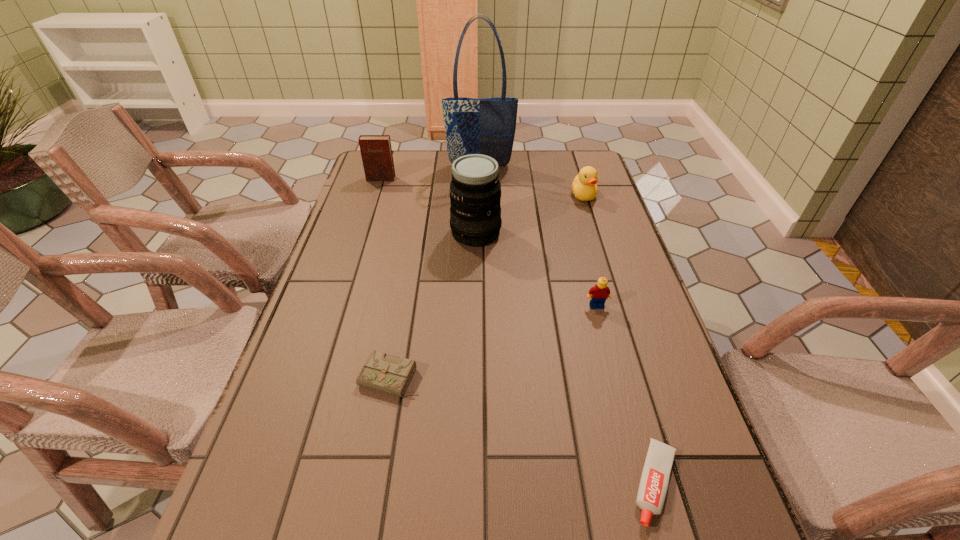
Locate an element on the screen. the shorter diary is located at coordinates (380, 372).

Find the location of a particular element. The width and height of the screenshot is (960, 540). toothpaste is located at coordinates (653, 486).

Identify the location of vacant space situated on the front-facing side of the tallest object. (480, 193).

The width and height of the screenshot is (960, 540). Find the location of `free space located on the front of the second tallest object`. free space located on the front of the second tallest object is located at coordinates click(474, 350).

Locate an element on the screen. This screenshot has height=540, width=960. free location located on the front cover of the second farthest object is located at coordinates (372, 207).

Locate an element on the screen. free space located on the face of the third farthest object is located at coordinates (599, 244).

The image size is (960, 540). Find the location of `free space located on the front-facing side of the third nearest object`. free space located on the front-facing side of the third nearest object is located at coordinates (602, 326).

Find the location of a particular element. blank space located on the back of the sixth farthest object is located at coordinates (398, 328).

The image size is (960, 540). What are the coordinates of `vacant space located on the left of the nearest object` in the screenshot? It's located at (574, 483).

The width and height of the screenshot is (960, 540). I want to click on shopping bag that is at the far edge, so tap(486, 126).